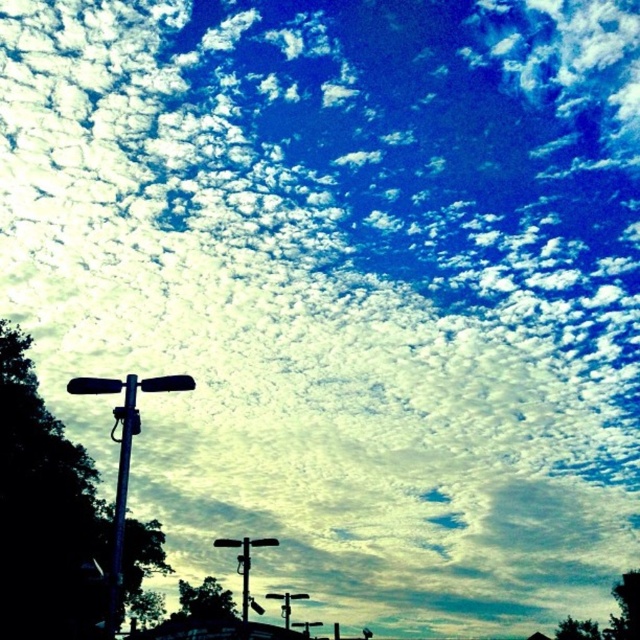
Question: Is the position of metallic blue pole at left more distant than that of metallic pole at center?

Choices:
 (A) no
 (B) yes

Answer: (A)

Question: Can you confirm if metallic blue pole at left is wider than metallic silver street sign at lower center?

Choices:
 (A) yes
 (B) no

Answer: (B)

Question: Which of these objects is positioned closest to the metallic pole at left?

Choices:
 (A) metallic blue pole at left
 (B) metallic pole at center
 (C) metallic silver street sign at lower center

Answer: (A)

Question: Estimate the real-world distances between objects in this image. Which object is closer to the metallic pole at left?

Choices:
 (A) metallic blue pole at left
 (B) metallic silver street sign at lower center
 (C) metallic pole at center

Answer: (A)

Question: Which object is positioned closest to the metallic silver street sign at lower center?

Choices:
 (A) metallic pole at left
 (B) metallic pole at center

Answer: (B)

Question: Is metallic pole at left in front of metallic silver street sign at lower center?

Choices:
 (A) no
 (B) yes

Answer: (B)